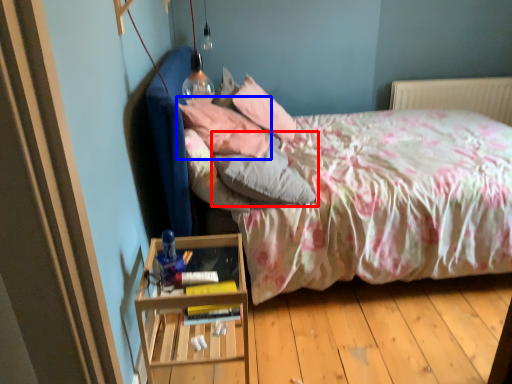
Question: Among these objects, which one is nearest to the camera, pillow (highlighted by a red box) or pillow (highlighted by a blue box)?

Choices:
 (A) pillow
 (B) pillow

Answer: (A)